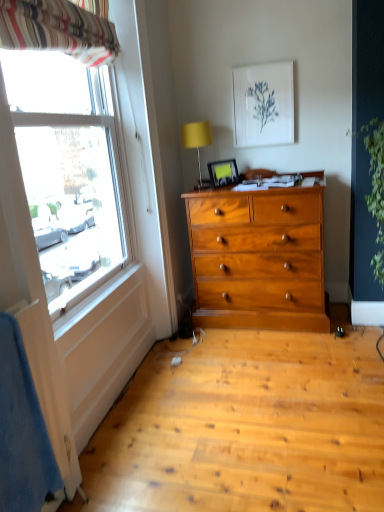
Question: Is there a large distance between white paper at upper center, positioned as the first picture frame in top-to-bottom order, and striped fabric curtain at upper left?

Choices:
 (A) no
 (B) yes

Answer: (B)

Question: Is white paper at upper center, the 1th picture frame positioned from the right, turned away from striped fabric curtain at upper left?

Choices:
 (A) yes
 (B) no

Answer: (B)

Question: Does white paper at upper center, acting as the second picture frame starting from the bottom, have a greater width compared to striped fabric curtain at upper left?

Choices:
 (A) no
 (B) yes

Answer: (A)

Question: Considering the relative sizes of white paper at upper center, acting as the second picture frame starting from the bottom, and striped fabric curtain at upper left in the image provided, is white paper at upper center, acting as the second picture frame starting from the bottom, bigger than striped fabric curtain at upper left?

Choices:
 (A) no
 (B) yes

Answer: (A)

Question: Can you confirm if white paper at upper center, positioned as the first picture frame in top-to-bottom order, is positioned to the right of striped fabric curtain at upper left?

Choices:
 (A) yes
 (B) no

Answer: (A)

Question: Are white paper at upper center, the 1th picture frame positioned from the right, and striped fabric curtain at upper left beside each other?

Choices:
 (A) no
 (B) yes

Answer: (A)

Question: Is striped fabric curtain at upper left at the right side of green leafy plant at right?

Choices:
 (A) no
 (B) yes

Answer: (A)

Question: Is green leafy plant at right surrounded by striped fabric curtain at upper left?

Choices:
 (A) no
 (B) yes

Answer: (A)

Question: Is striped fabric curtain at upper left not close to green leafy plant at right?

Choices:
 (A) yes
 (B) no

Answer: (A)

Question: Can you confirm if striped fabric curtain at upper left is bigger than green leafy plant at right?

Choices:
 (A) yes
 (B) no

Answer: (B)

Question: Is striped fabric curtain at upper left outside green leafy plant at right?

Choices:
 (A) yes
 (B) no

Answer: (A)

Question: Can you confirm if striped fabric curtain at upper left is smaller than green leafy plant at right?

Choices:
 (A) yes
 (B) no

Answer: (A)

Question: Are striped fabric curtain at upper left and yellow fabric lampshade at upper center located far from each other?

Choices:
 (A) yes
 (B) no

Answer: (A)